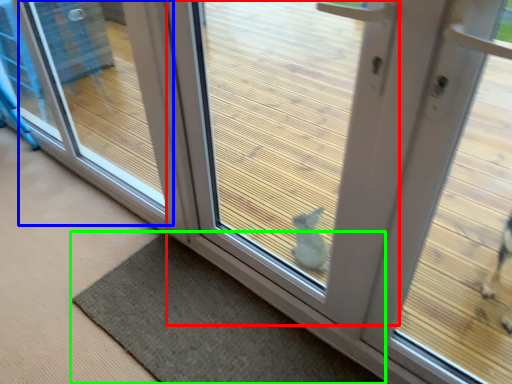
Question: Estimate the real-world distances between objects in this image. Which object is closer to door (highlighted by a red box), window (highlighted by a blue box) or mat (highlighted by a green box)?

Choices:
 (A) window
 (B) mat

Answer: (B)